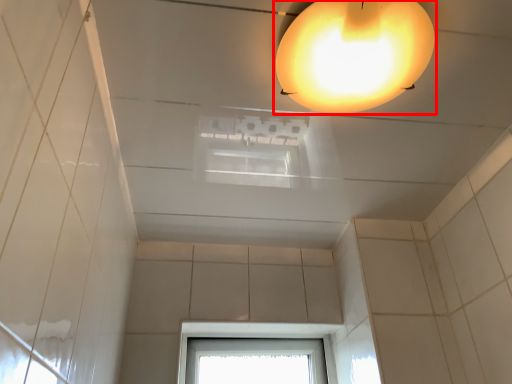
Question: In this image, where is lamp (annotated by the red box) located relative to window?

Choices:
 (A) right
 (B) left

Answer: (A)